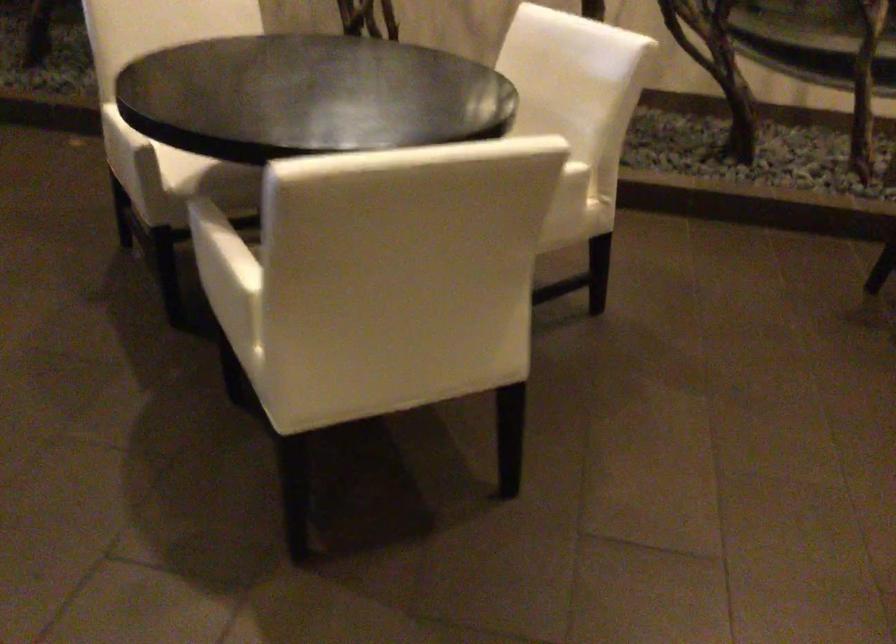
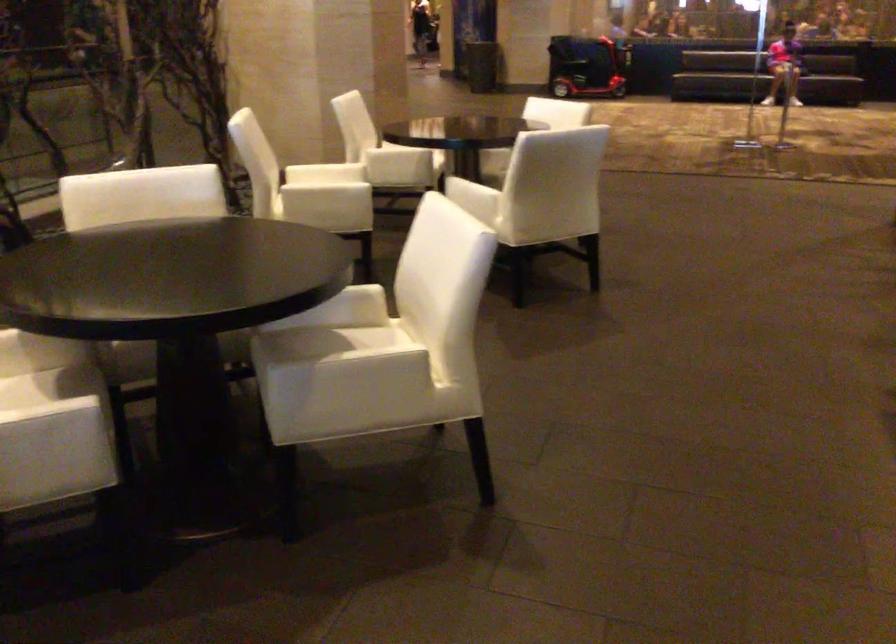
In the second image, find the point that corresponds to (119,138) in the first image.

(56, 422)